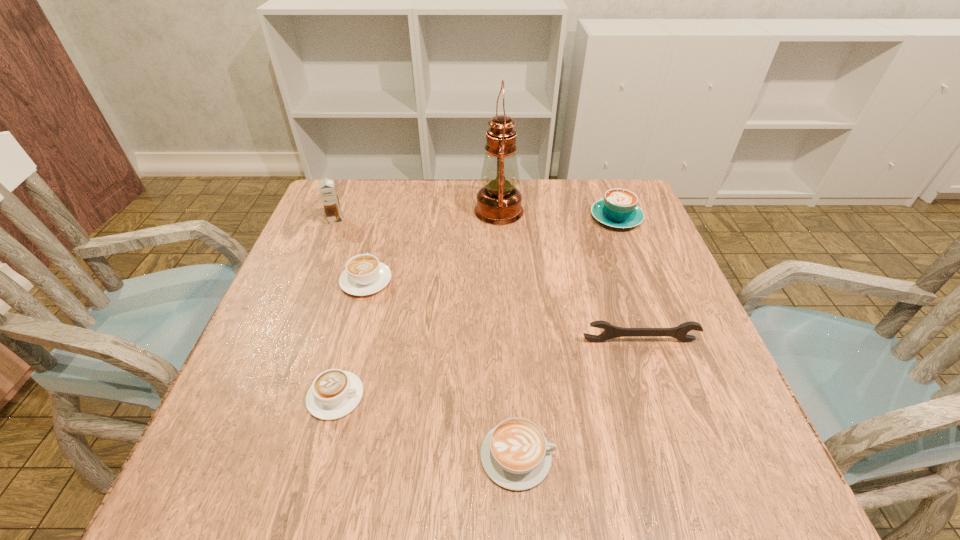
The image size is (960, 540). I want to click on oil lamp, so click(x=499, y=202).

You are a GUI agent. You are given a task and a screenshot of the screen. Output one action in this format:
    pyautogui.click(x=<x>, y=<y>)
    Task: Click on the sixth shortest object
    
    Given the screenshot: What is the action you would take?
    pyautogui.click(x=327, y=189)

Where is `chocolate milk`? The image size is (960, 540). chocolate milk is located at coordinates (327, 189).

Find the location of a particular element. the tallest cappuccino is located at coordinates (618, 209).

Find the location of `the farthest cappuccino`. the farthest cappuccino is located at coordinates (618, 209).

Image resolution: width=960 pixels, height=540 pixels. Find the location of `the third nearest object`. the third nearest object is located at coordinates (610, 331).

Identify the location of the second farthest cappuccino. This screenshot has width=960, height=540. (364, 275).

This screenshot has height=540, width=960. Identify the location of the second nearest cappuccino. (335, 393).

Where is `the third cappuccino from left to right`? The width and height of the screenshot is (960, 540). the third cappuccino from left to right is located at coordinates (515, 454).

Where is `the nearest cappuccino`? The width and height of the screenshot is (960, 540). the nearest cappuccino is located at coordinates (515, 454).